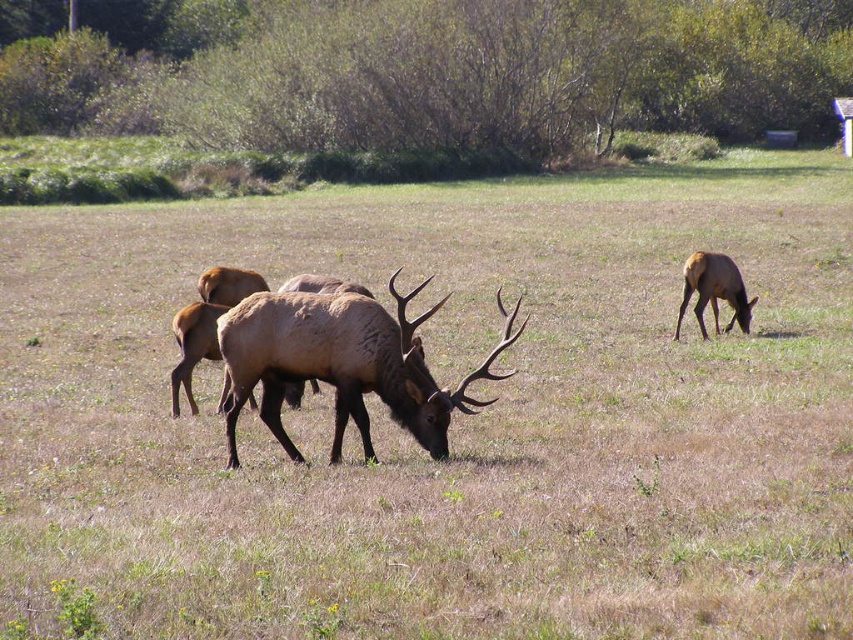
Question: Observing the image, what is the correct spatial positioning of brown velvet antlers at center in reference to brown matte/deer at right?

Choices:
 (A) below
 (B) above

Answer: (A)

Question: Where is brown velvet antlers at center located in relation to brown matte/deer at right in the image?

Choices:
 (A) above
 (B) below

Answer: (B)

Question: Among these points, which one is nearest to the camera?

Choices:
 (A) (345, 310)
 (B) (744, 296)

Answer: (A)

Question: Among these points, which one is nearest to the camera?

Choices:
 (A) (338, 461)
 (B) (705, 333)

Answer: (A)

Question: Is brown velvet antlers at center bigger than brown matte/deer at right?

Choices:
 (A) no
 (B) yes

Answer: (B)